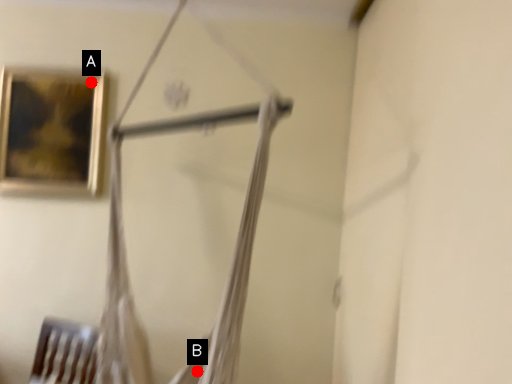
Question: Two points are circled on the image, labeled by A and B beside each circle. Which of the following is the farthest from the observer?

Choices:
 (A) A is further
 (B) B is further

Answer: (A)